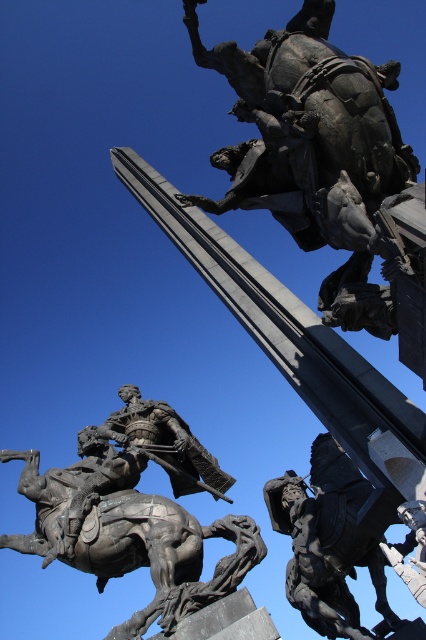
You are an art student analyzing the monument. You notice the bronze statue at center and the polished bronze rider at center. Which one appears bigger in the image?

The bronze statue at center is larger in size than the polished bronze rider at center, so the bronze statue at center appears bigger.

You are an art student analyzing the monument. You notice two key figures in the scene. Which one is taller, the bronze statue at upper center or the polished bronze rider at center?

The bronze statue at upper center is much taller than the polished bronze rider at center.